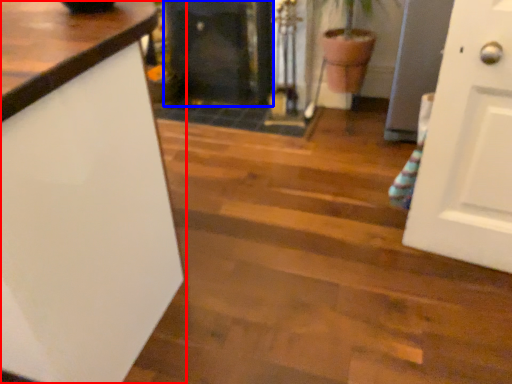
Question: Among these objects, which one is nearest to the camera, countertop (highlighted by a red box) or fireplace (highlighted by a blue box)?

Choices:
 (A) countertop
 (B) fireplace

Answer: (A)